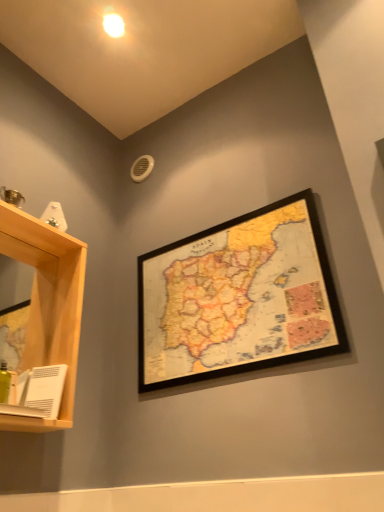
Question: Are white matte book at lower left and wooden framed map at upper center far apart?

Choices:
 (A) no
 (B) yes

Answer: (A)

Question: Is white matte book at lower left at the right side of wooden framed map at upper center?

Choices:
 (A) no
 (B) yes

Answer: (A)

Question: From the image's perspective, is white matte book at lower left over wooden framed map at upper center?

Choices:
 (A) no
 (B) yes

Answer: (A)

Question: Considering the relative sizes of white matte book at lower left and wooden framed map at upper center in the image provided, is white matte book at lower left taller than wooden framed map at upper center?

Choices:
 (A) no
 (B) yes

Answer: (A)

Question: Is white matte book at lower left bigger than wooden framed map at upper center?

Choices:
 (A) yes
 (B) no

Answer: (B)

Question: From the image's perspective, is white matte book at lower left below wooden framed map at upper center?

Choices:
 (A) no
 (B) yes

Answer: (B)

Question: Is white glossy light bulb at upper center positioned beyond the bounds of white matte book at lower left?

Choices:
 (A) yes
 (B) no

Answer: (A)

Question: Considering the relative sizes of white glossy light bulb at upper center and white matte book at lower left in the image provided, is white glossy light bulb at upper center smaller than white matte book at lower left?

Choices:
 (A) yes
 (B) no

Answer: (A)

Question: Is white glossy light bulb at upper center oriented towards white matte book at lower left?

Choices:
 (A) no
 (B) yes

Answer: (A)

Question: From a real-world perspective, is white glossy light bulb at upper center on top of white matte book at lower left?

Choices:
 (A) no
 (B) yes

Answer: (B)

Question: Can you confirm if white glossy light bulb at upper center is wider than white matte book at lower left?

Choices:
 (A) no
 (B) yes

Answer: (B)

Question: Is white glossy light bulb at upper center in front of white matte book at lower left?

Choices:
 (A) yes
 (B) no

Answer: (B)

Question: Does white matte book at lower left have a greater height compared to light wood shelf at left?

Choices:
 (A) yes
 (B) no

Answer: (B)